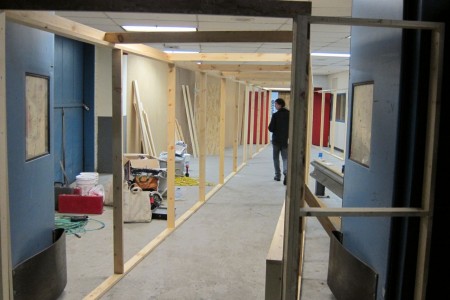
This screenshot has width=450, height=300. What are the coordinates of `shoe` in the screenshot? It's located at (283, 182), (275, 178).